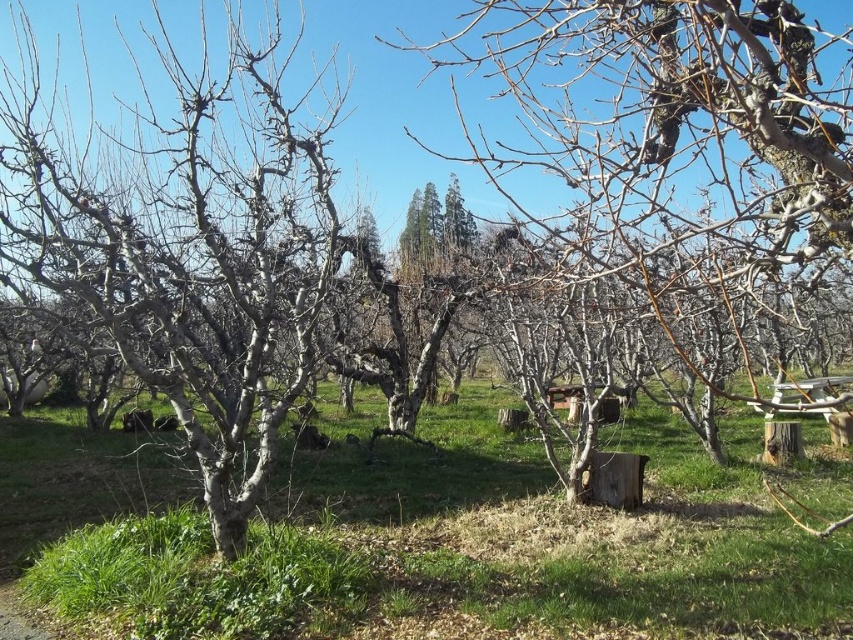
You are standing in the orchard and want to place a small garden ornament between the green grassy at center and the smooth bark tree at center. Based on their positions, where should you place it to ensure it is between them?

The green grassy at center is below the smooth bark tree at center, so placing the ornament between them would mean positioning it under the tree but above the grassy area.

You are an arborist inspecting the orchard and need to determine which tree has a smaller trunk diameter between the smooth bark tree at center and the smooth gray tree at center. Based on the scene, which one should you measure first?

The smooth bark tree at center is thinner than the smooth gray tree at center, so you should measure the smooth bark tree at center first to confirm its smaller diameter.

You are a gardener who wants to plant a new tree in the orchard. The new tree you have is 2 meters tall. The existing smooth gray tree at center is 3 meters tall. Can you plant the new tree so that it doesn not block the sunlight from reaching the green grassy at center?

The green grassy at center is shorter than the smooth gray tree at center. Since the new tree is 2 meters tall and the existing tree is 3 meters tall, planting the new tree at a distance where its shadow does not fall on the grass during the sunniest part of the day would ensure sunlight reaches the green grassy at center.